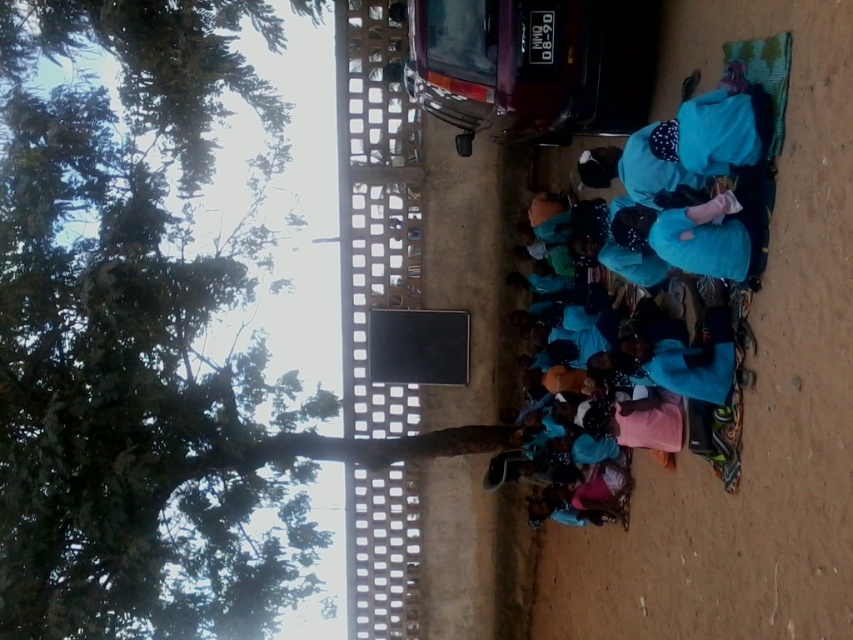
Question: Is green leafy tree at upper left bigger than blue fabric at center?

Choices:
 (A) no
 (B) yes

Answer: (B)

Question: Can you confirm if green leafy tree at upper left is positioned above blue fabric at center?

Choices:
 (A) no
 (B) yes

Answer: (A)

Question: Is green leafy tree at upper left smaller than blue fabric at center?

Choices:
 (A) yes
 (B) no

Answer: (B)

Question: Which point is farther to the camera?

Choices:
 (A) blue fabric at center
 (B) green leafy tree at upper left

Answer: (B)

Question: Among these objects, which one is farthest from the camera?

Choices:
 (A) blue fabric at center
 (B) green leafy tree at upper left

Answer: (B)

Question: Which point is closer to the camera?

Choices:
 (A) green leafy tree at upper left
 (B) blue fabric at center

Answer: (B)